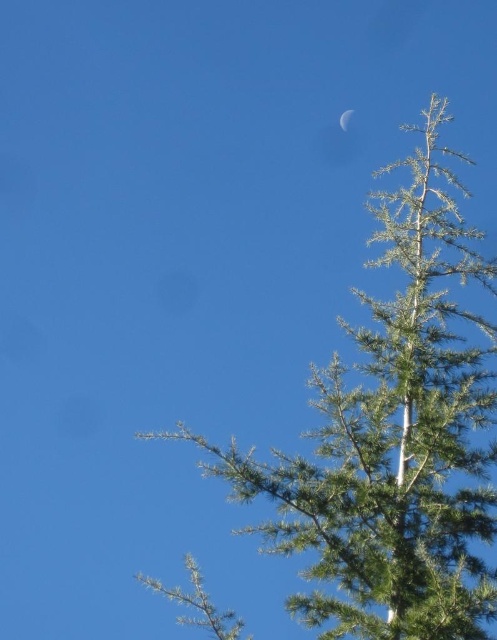
You are observing the image and want to know which of the two points, point [430,593] or point [352,109], is nearer to you. Based on the scene description, can you determine this?

Point [430,593] is closer to the camera than point [352,109].